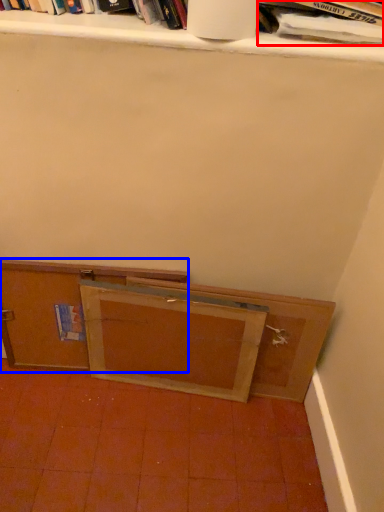
Question: Among these objects, which one is farthest to the camera, book (highlighted by a red box) or cabinetry (highlighted by a blue box)?

Choices:
 (A) book
 (B) cabinetry

Answer: (B)